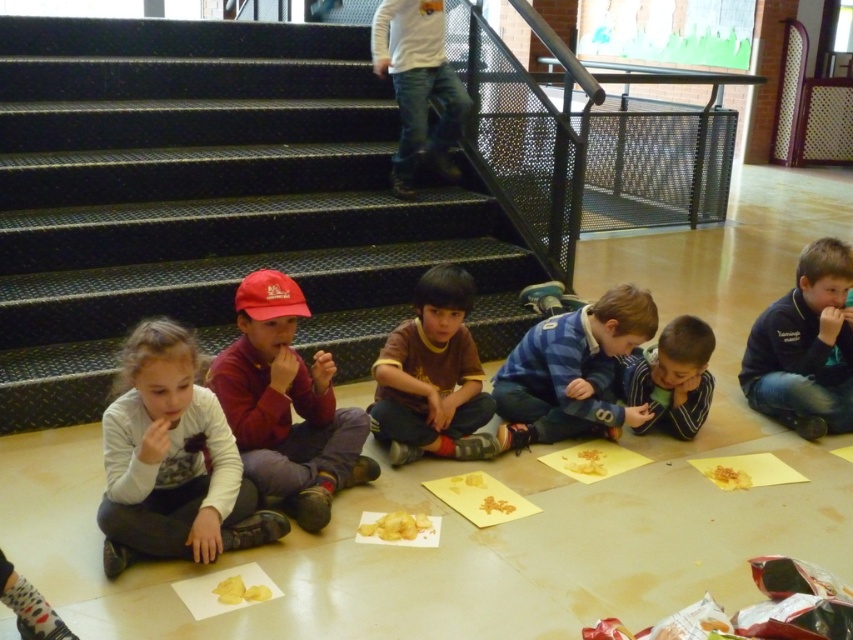
Question: Does yellow matte cookie at lower right have a larger size compared to yellow matte cookie at center?

Choices:
 (A) yes
 (B) no

Answer: (A)

Question: Does yellow matte chips at lower left appear under yellow matte cookie at lower right?

Choices:
 (A) no
 (B) yes

Answer: (B)

Question: Which of the following is the farthest from the observer?

Choices:
 (A) (711, 468)
 (B) (238, 172)
 (C) (238, 598)

Answer: (B)

Question: Can you confirm if blue striped sweater at center is positioned below blue fleece jacket at lower right?

Choices:
 (A) no
 (B) yes

Answer: (B)

Question: Estimate the real-world distances between objects in this image. Which object is closer to the brown soft shirt at center?

Choices:
 (A) black metal stairs at upper left
 (B) yellow matte cookie at lower right

Answer: (B)

Question: Which object is closer to the camera taking this photo?

Choices:
 (A) yellow matte chips at lower left
 (B) matte white sweater at lower left
 (C) yellow matte cookie at center
 (D) smooth green shirt at center

Answer: (B)